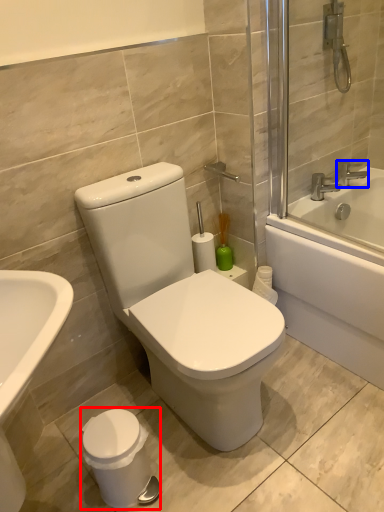
Question: Which point is closer to the camera, porcelain (highlighted by a red box) or tap (highlighted by a blue box)?

Choices:
 (A) porcelain
 (B) tap

Answer: (A)